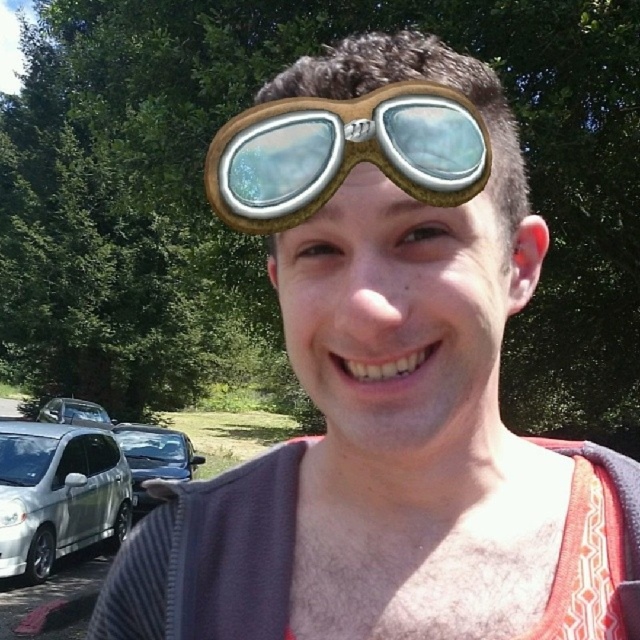
You are a photographer trying to capture the brown leather goggles at center and the white glossy car at lower left in the same frame. Based on their sizes in the image, which object would appear smaller in the photo?

The brown leather goggles at center would appear smaller in the photo because they are shorter than the white glossy car at lower left.

You are standing next to the person wearing the vintage goggles and looking at the cars parked behind them. Which car is closer to you, the shiny black car at lower left or the white glossy car at lower left?

The shiny black car at lower left is closer to you because it is in front of the white glossy car at lower left.

You are a photographer using a camera with a minimum focusing distance of 18 inches. You want to take a clear photo of the brown leather goggles at center. Can you do it from your current position?

The distance between the brown leather goggles at center and the camera is 16.25 inches, which is less than the camera minimum focusing distance of 18 inches. Move back to increase the distance so the camera can focus properly.